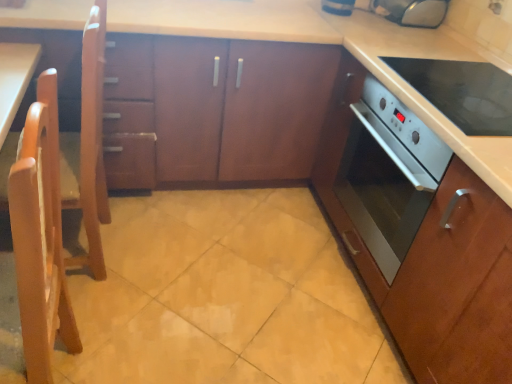
Find the location of a particular element. The width and height of the screenshot is (512, 384). vacant area that lies in front of metallic silver toaster at upper right, which is the 2th appliance from left to right is located at coordinates (416, 35).